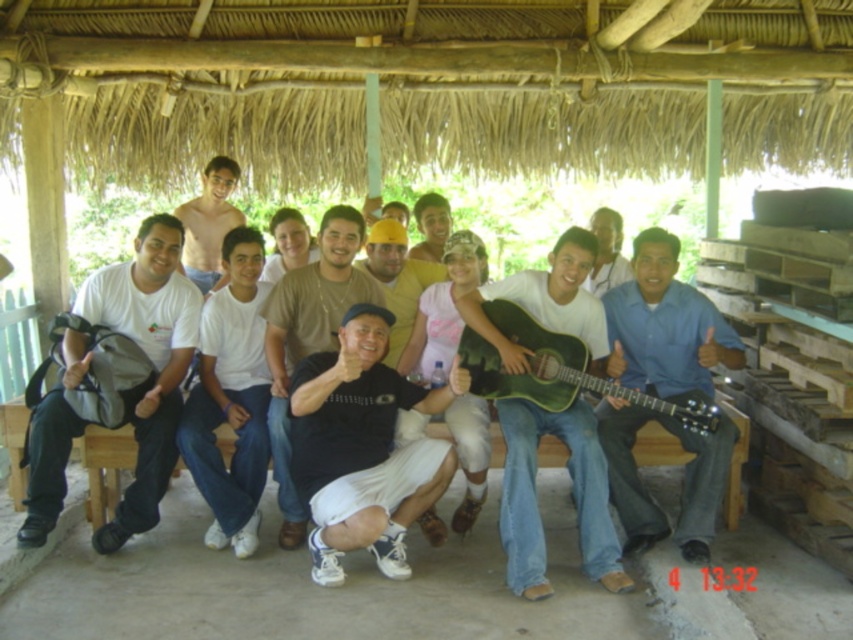
You are organizing a photo shoot and need to ensure that the white cotton shirt at center and the smooth yellow cap at center are visible in the frame. Given their sizes, which object might require more space in the composition to be fully captured?

The white cotton shirt at center requires more space in the composition because its width is larger than the smooth yellow cap at center.

Consider the image. You are standing in front of the thatched roof structure and want to locate the white cotton shirt at center. Based on the coordinates provided, where would you look to find it?

The white cotton shirt at center is located at coordinates point 0.622 on the x axis and 0.272 on the y axis.

You are a photographer taking a picture of the group under the thatched roof. You notice the white cotton shirt at center and the shiny skin at center. Which object should you focus on first to ensure both are in sharp focus?

The shiny skin at center should be focused on first since it is above the white cotton shirt at center, so adjusting focus starting from the higher object ensures both are in sharp focus.